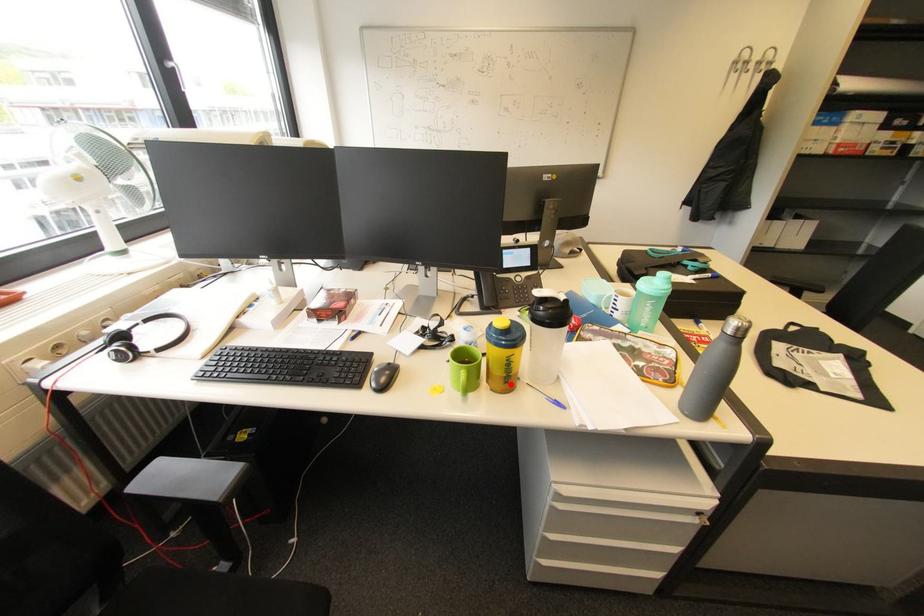
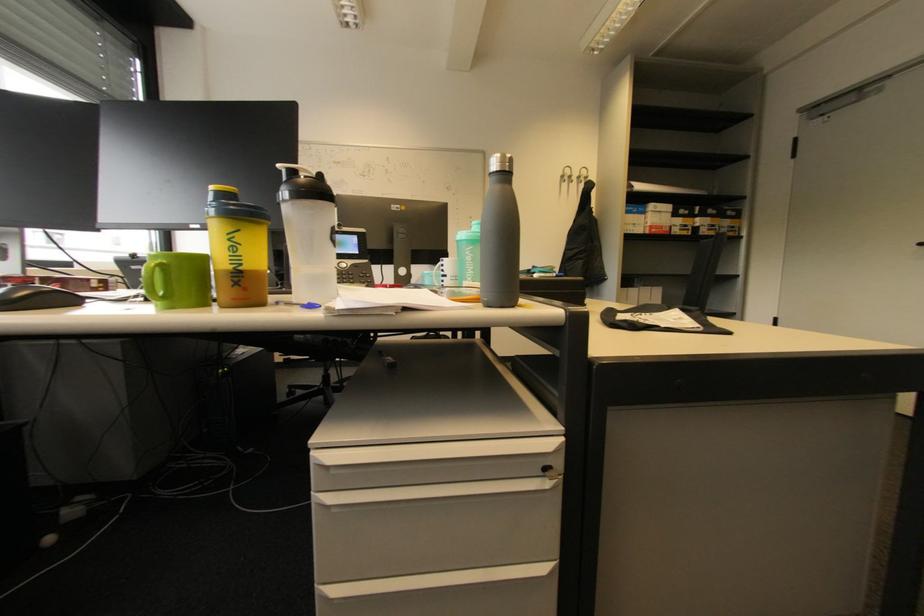
Question: I am providing you with two images of the same scene from different viewpoints. A red point is marked on the first image. Is the red point's position out of view in image 2?

Choices:
 (A) Yes
 (B) No

Answer: (B)